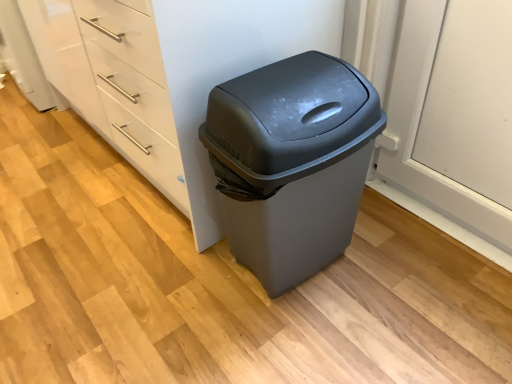
Question: Is matte gray plastic trash can at center spatially inside white glossy dresser at center, or outside of it?

Choices:
 (A) outside
 (B) inside

Answer: (A)

Question: From the image's perspective, relative to white glossy dresser at center, is matte gray plastic trash can at center above or below?

Choices:
 (A) below
 (B) above

Answer: (A)

Question: From a real-world perspective, relative to white glossy dresser at center, is matte gray plastic trash can at center vertically above or below?

Choices:
 (A) above
 (B) below

Answer: (B)

Question: Is point (29, 1) closer or farther from the camera than point (352, 205)?

Choices:
 (A) closer
 (B) farther

Answer: (B)

Question: Choose the correct answer: Is white glossy dresser at center inside matte gray plastic trash can at center or outside it?

Choices:
 (A) outside
 (B) inside

Answer: (A)

Question: From the image's perspective, is white glossy dresser at center positioned above or below matte gray plastic trash can at center?

Choices:
 (A) below
 (B) above

Answer: (B)

Question: Is white glossy dresser at center wider or thinner than matte gray plastic trash can at center?

Choices:
 (A) wide
 (B) thin

Answer: (A)